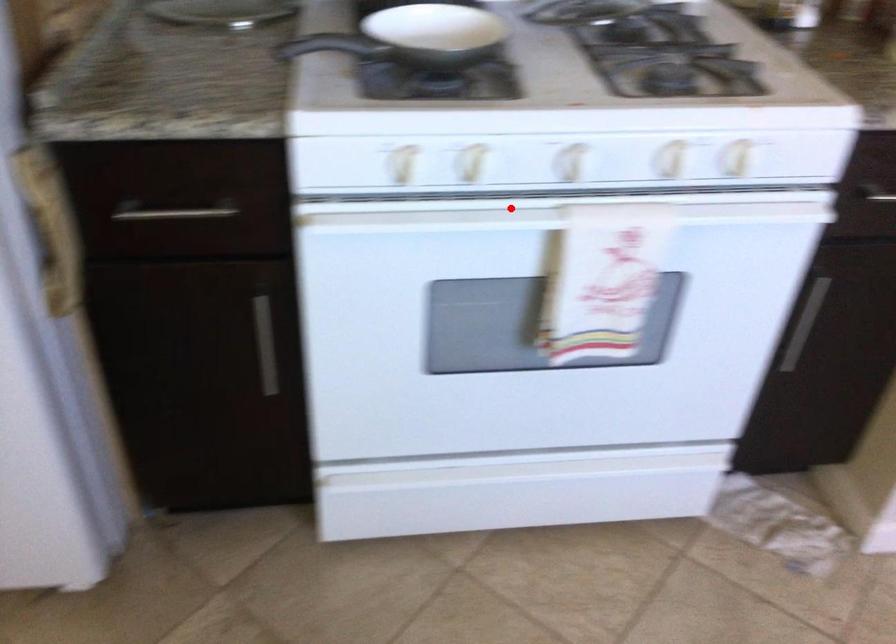
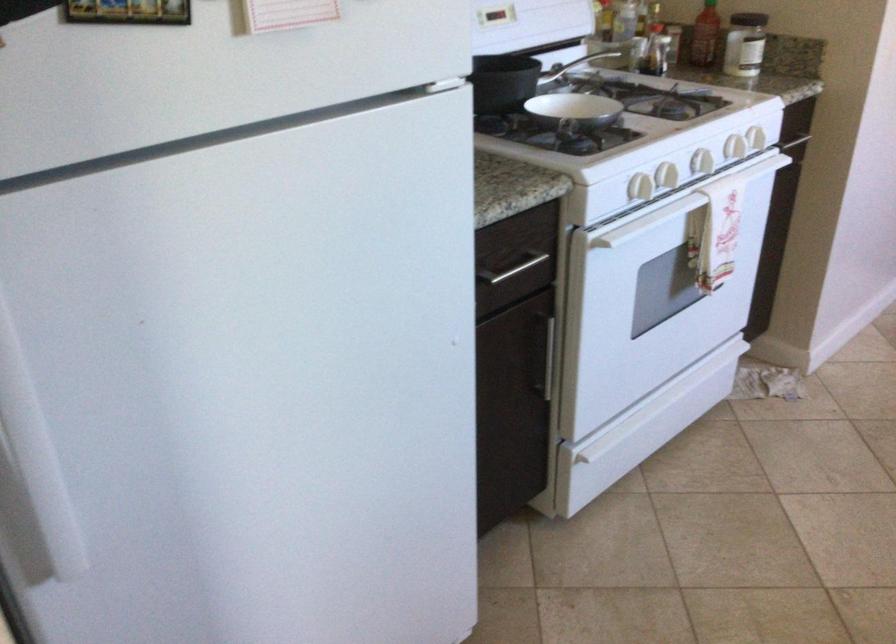
Question: I am providing you with two images of the same scene from different viewpoints. Image1 has a red point marked. In image2, the corresponding 3D location appears at what relative position? Reply with the corresponding letter.

Choices:
 (A) Closer
 (B) Farther

Answer: (B)